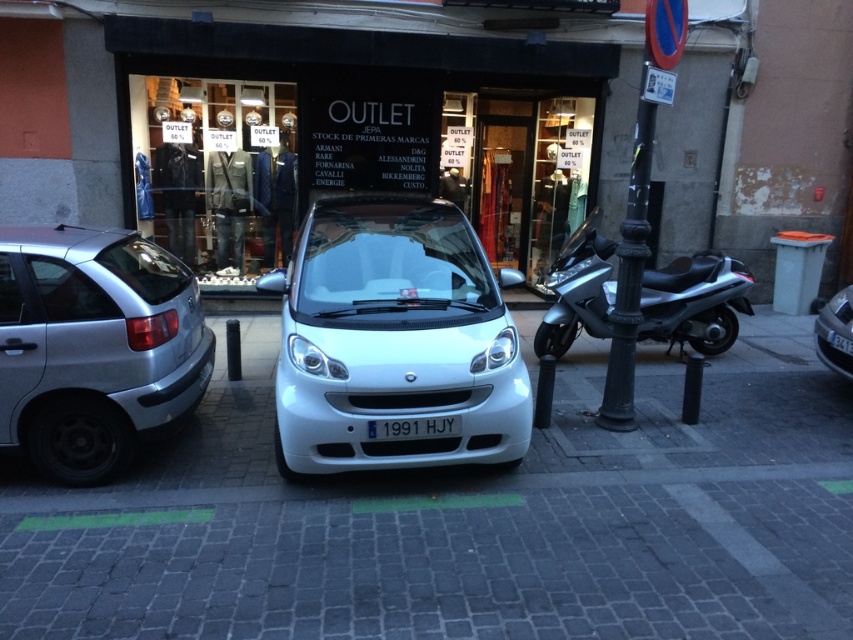
You are a delivery person trying to park your metallic silver scooter at right near the dark gray metal pole at right. Based on the scene, can you safely park the scooter closer to the pole without blocking the storefront entrance?

The metallic silver scooter at right is already positioned closer to the viewer than the dark gray metal pole at right, meaning the pole is behind the scooter. Therefore, you can safely park the scooter closer to the pole without blocking the storefront entrance since there is space between them.

You are a delivery person trying to park your van between the white glossy car at center and the silver metallic hatchback at left. The van is 5 meters long. Can you fit your van in the space between them?

The white glossy car at center is larger than the silver metallic hatchback at left, but the distance between them isn not specified. Without knowing the exact spacing, it is impossible to determine if the van will fit.